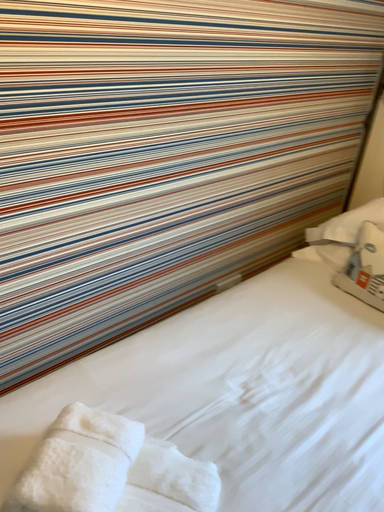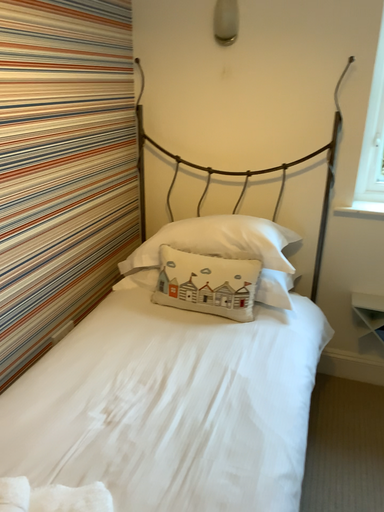
Question: How did the camera likely rotate when shooting the video?

Choices:
 (A) rotated left
 (B) rotated right

Answer: (B)